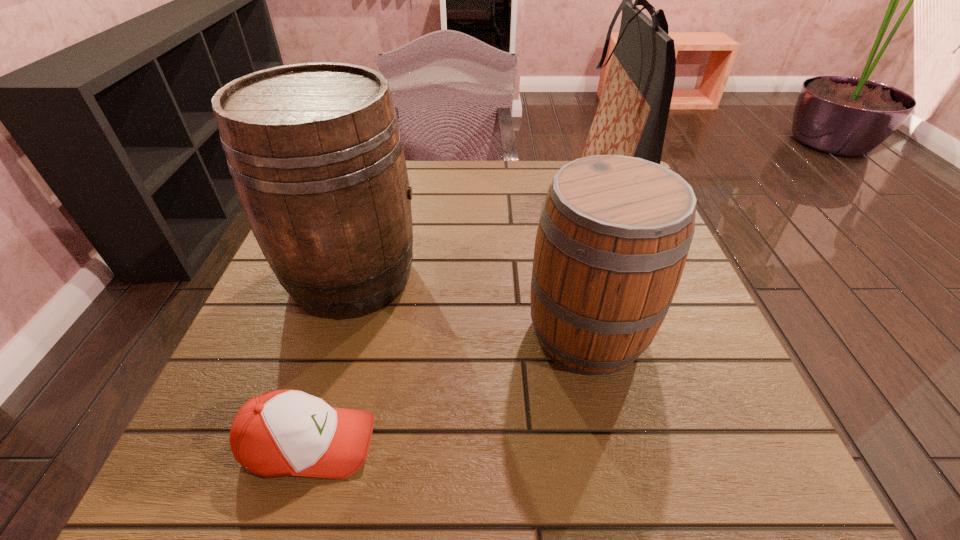
Where is `free space located on the side of the left cider near the bung hole`? The image size is (960, 540). free space located on the side of the left cider near the bung hole is located at coordinates pos(623,276).

The height and width of the screenshot is (540, 960). In order to click on free space located on the left of the right cider in this screenshot , I will do `click(332, 332)`.

This screenshot has height=540, width=960. I want to click on free space located on the front-facing side of the shortest object, so click(586, 443).

What are the coordinates of `object that is at the far edge` in the screenshot? It's located at (631, 118).

Locate an element on the screen. object located in the near edge section of the desktop is located at coordinates (280, 433).

The image size is (960, 540). I want to click on cider that is positioned at the left edge, so click(316, 155).

Locate an element on the screen. Image resolution: width=960 pixels, height=540 pixels. baseball cap that is at the left edge is located at coordinates (280, 433).

Identify the location of shopping bag positioned at the right edge. This screenshot has height=540, width=960. (631, 118).

What are the coordinates of `cider at the right edge` in the screenshot? It's located at (614, 233).

I want to click on object located in the near left corner section of the desktop, so click(280, 433).